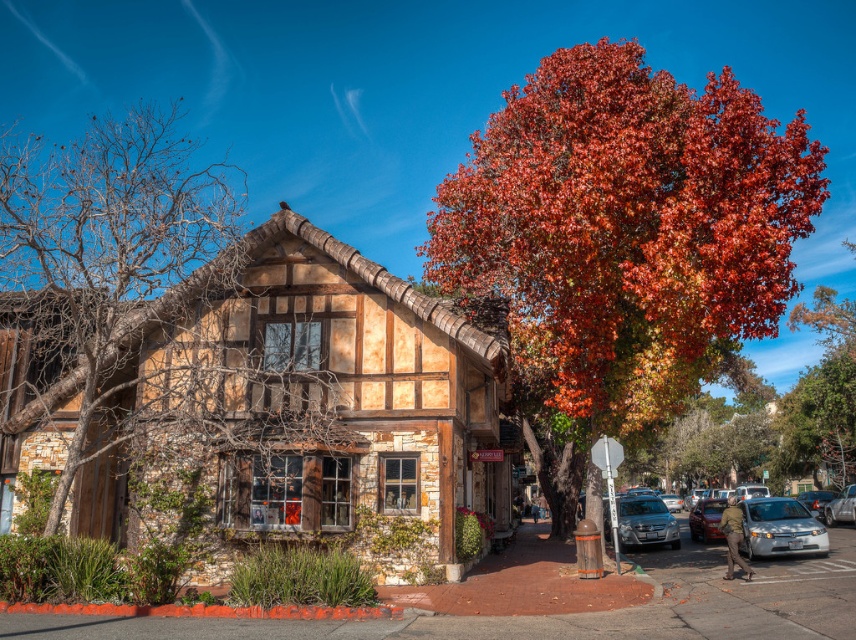
You are standing in front of the building and want to park your car. You have two options, the silver metallic sedan at lower right and the satin silver sedan at center. Which one is closer to you?

The silver metallic sedan at lower right is closer to the viewer than the satin silver sedan at center, so the silver metallic sedan at lower right is closer to you.